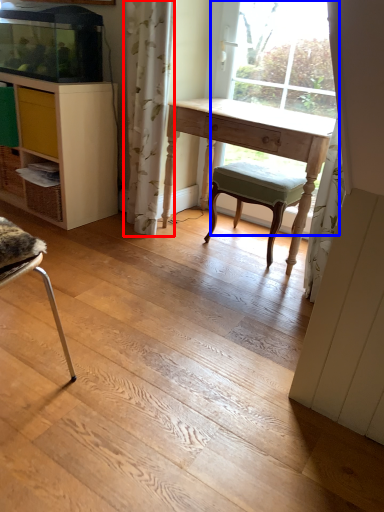
Question: Which object appears farthest to the camera in this image, curtain (highlighted by a red box) or bay window (highlighted by a blue box)?

Choices:
 (A) curtain
 (B) bay window

Answer: (B)